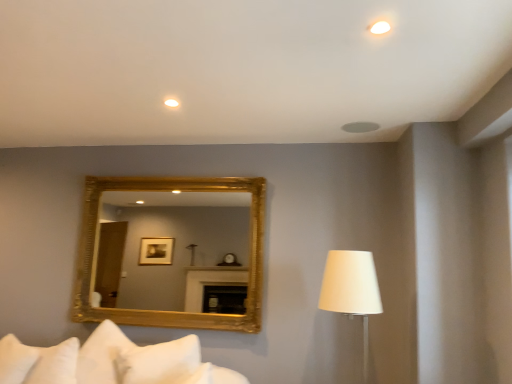
You are a GUI agent. You are given a task and a screenshot of the screen. Output one action in this format:
    pyautogui.click(x=<x>, y=<y>)
    Task: Click on the free spot behind white matte ceiling light at upper center, the 2th lighting from the top
    This screenshot has height=384, width=512.
    Given the screenshot: What is the action you would take?
    pyautogui.click(x=175, y=107)